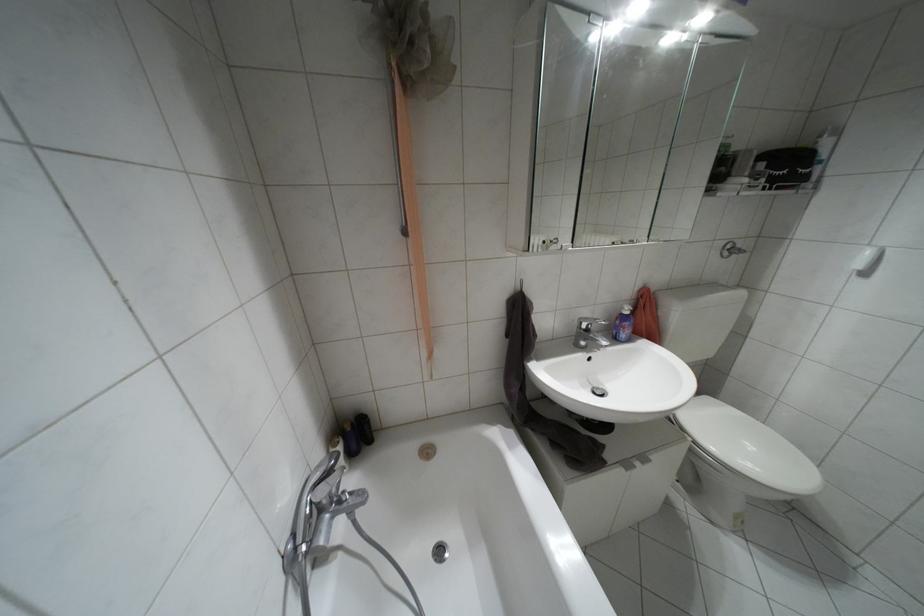
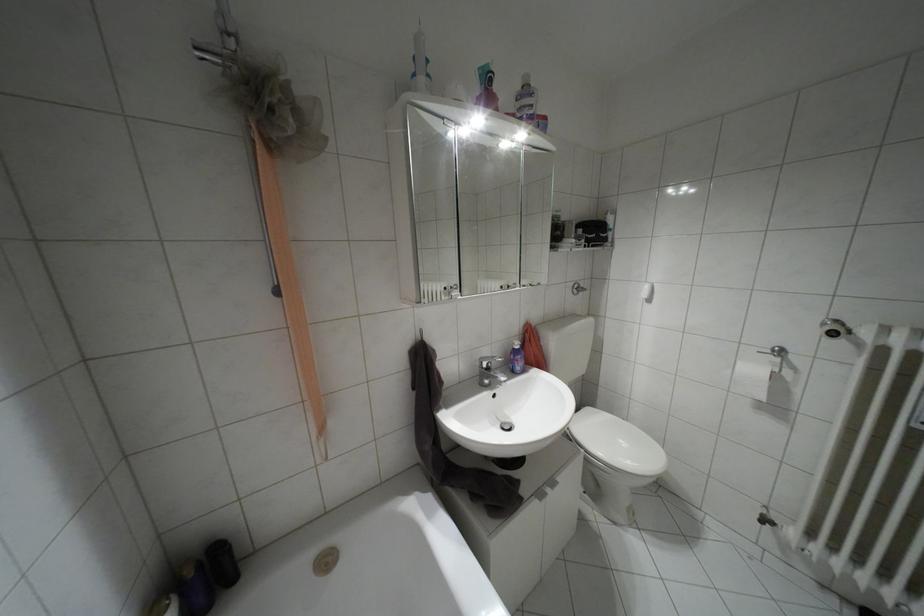
Question: What movement of the cameraman would produce the second image?

Choices:
 (A) Left
 (B) Right
 (C) Forward
 (D) Backward

Answer: (B)